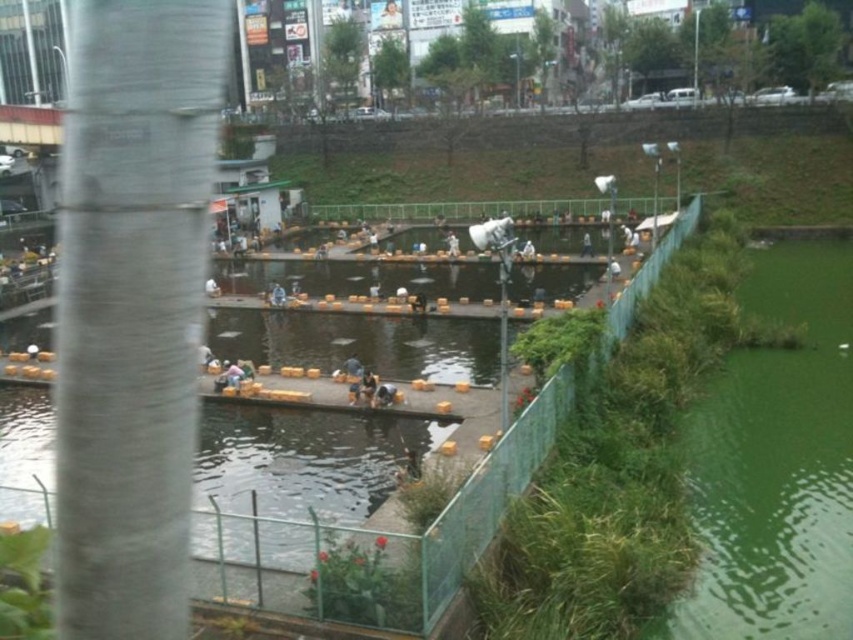
Does light brown wooden chair at center have a lesser height compared to dark blue fabric person at center?

No, light brown wooden chair at center is not shorter than dark blue fabric person at center.

Which is behind, point (225, 369) or point (357, 376)?

The point (225, 369) is more distant.

Which is in front, point (221, 376) or point (352, 371)?

Point (221, 376)

Where is `light brown wooden chair at center`? This screenshot has width=853, height=640. light brown wooden chair at center is located at coordinates (231, 374).

Is green liquid water at lower right smaller than dark blue fabric person at center?

No, green liquid water at lower right is not smaller than dark blue fabric person at center.

Measure the distance from green liquid water at lower right to dark blue fabric person at center.

green liquid water at lower right is 12.22 meters from dark blue fabric person at center.

Between point (753, 387) and point (346, 360), which one is positioned behind?

The point (346, 360) is behind.

Identify the location of green liquid water at lower right. (775, 461).

Can you confirm if green liquid water at lower right is positioned to the right of light brown wooden chair at center?

Yes, green liquid water at lower right is to the right of light brown wooden chair at center.

Consider the image. Between green liquid water at lower right and light brown wooden chair at center, which one has less height?

With less height is light brown wooden chair at center.

Who is more distant from viewer, (822,445) or (230,372)?

Point (230,372)

You are a GUI agent. You are given a task and a screenshot of the screen. Output one action in this format:
    pyautogui.click(x=<x>, y=<y>)
    Task: Click on the green liquid water at lower right
    This screenshot has height=640, width=853.
    Given the screenshot: What is the action you would take?
    pyautogui.click(x=775, y=461)